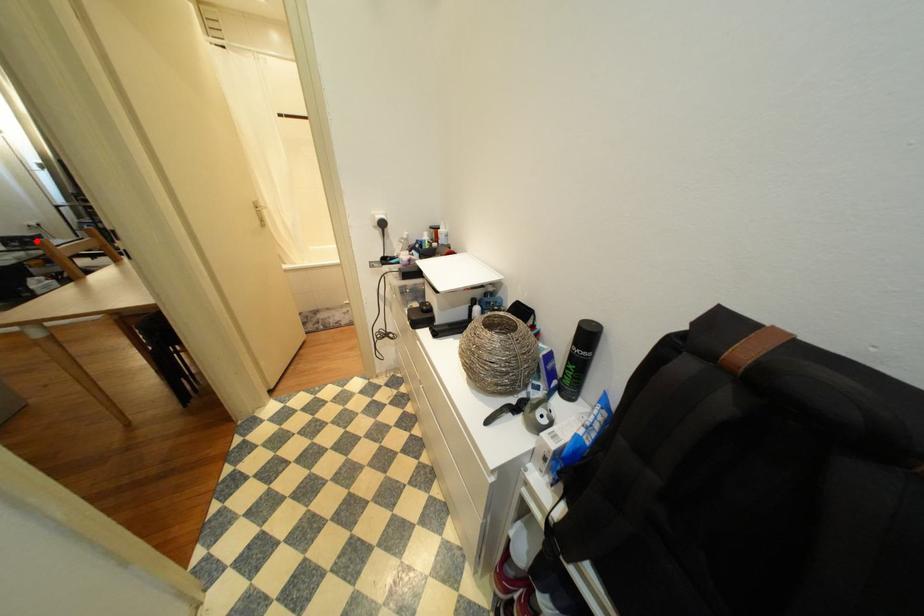
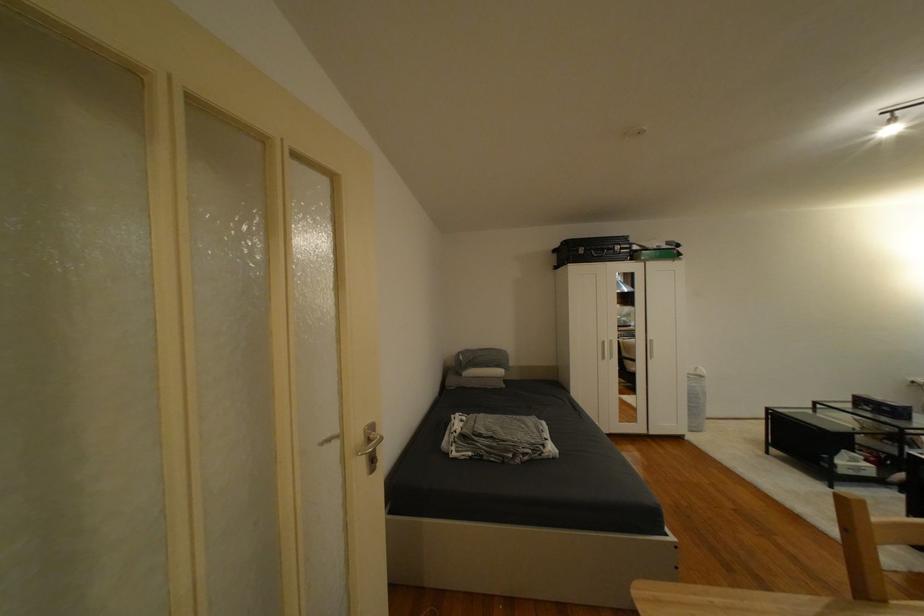
Find the pixel in the second image that matches the highlighted location in the first image.

(894, 410)